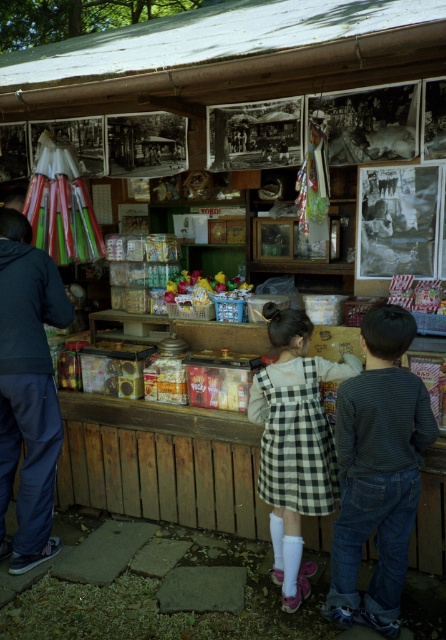
Question: Which object is positioned closest to the striped long-sleeve shirt at center?

Choices:
 (A) checkered fabric dress at center
 (B) dark blue fabric at left

Answer: (A)

Question: Which of the following is the farthest from the observer?

Choices:
 (A) (20, 403)
 (B) (434, 440)
 (C) (317, 371)

Answer: (A)

Question: Is dark blue fabric at left above checkered fabric dress at center?

Choices:
 (A) yes
 (B) no

Answer: (A)

Question: Does striped long-sleeve shirt at center have a larger size compared to dark blue fabric at left?

Choices:
 (A) no
 (B) yes

Answer: (A)

Question: Which object is positioned closest to the checkered fabric dress at center?

Choices:
 (A) striped long-sleeve shirt at center
 (B) dark blue fabric at left

Answer: (A)

Question: Is striped long-sleeve shirt at center bigger than dark blue fabric at left?

Choices:
 (A) no
 (B) yes

Answer: (A)